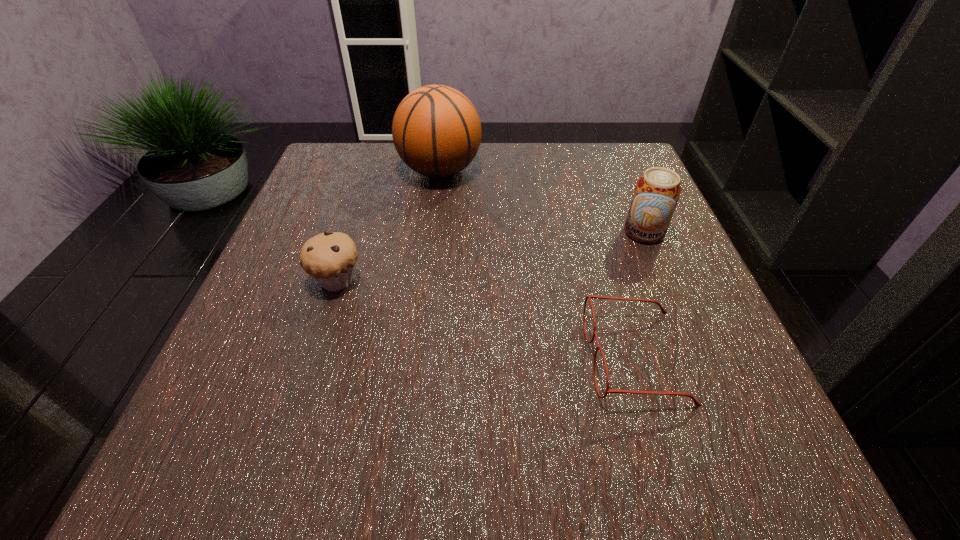
You are a GUI agent. You are given a task and a screenshot of the screen. Output one action in this format:
    pyautogui.click(x=<x>, y=<y>)
    Task: Click on the vacant space at the left edge of the desktop
    This screenshot has height=540, width=960.
    Given the screenshot: What is the action you would take?
    pyautogui.click(x=217, y=397)

At what (x,y) coordinates should I click in order to perform the action: click on vacant space at the right edge of the desktop. Please return your answer as a coordinate pair (x, y). Looking at the image, I should click on (627, 342).

The image size is (960, 540). Identify the location of free space at the near left corner. (300, 453).

Where is `vacant area at the far right corner of the desktop`? vacant area at the far right corner of the desktop is located at coordinates 601,152.

Locate an element on the screen. This screenshot has width=960, height=540. free spot at the near right corner of the desktop is located at coordinates (678, 428).

This screenshot has height=540, width=960. In order to click on vacant area that lies between the shortest object and the leftmost object in this screenshot , I will do `click(487, 319)`.

Find the location of a particular element. Image resolution: width=960 pixels, height=540 pixels. vacant space that is in between the spectacles and the third tallest object is located at coordinates (487, 319).

Locate an element on the screen. free space between the beer can and the third object from right to left is located at coordinates (541, 201).

Identify the location of vacant space in between the beer can and the shortest object. (639, 295).

Identify the location of unoccupied area between the third nearest object and the nearest object. (639, 295).